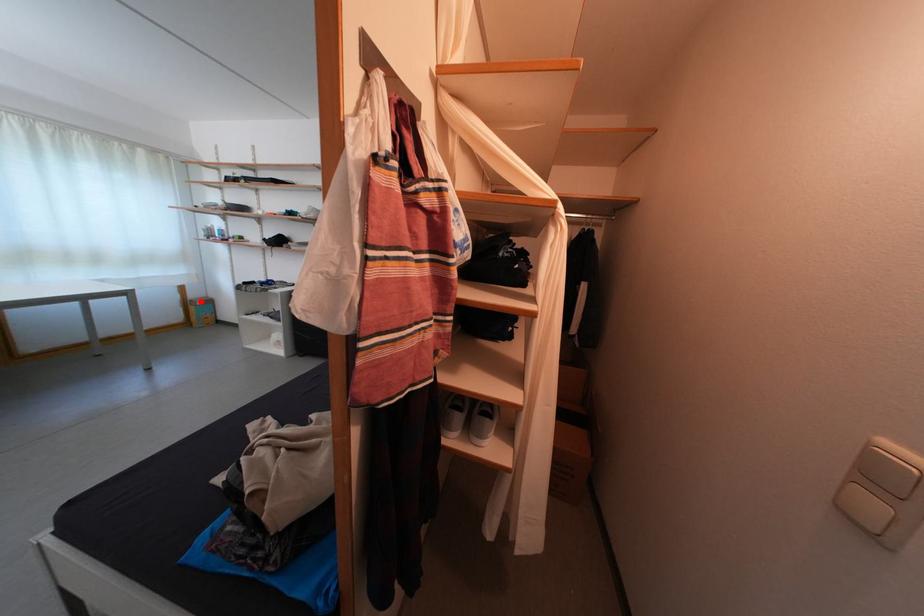
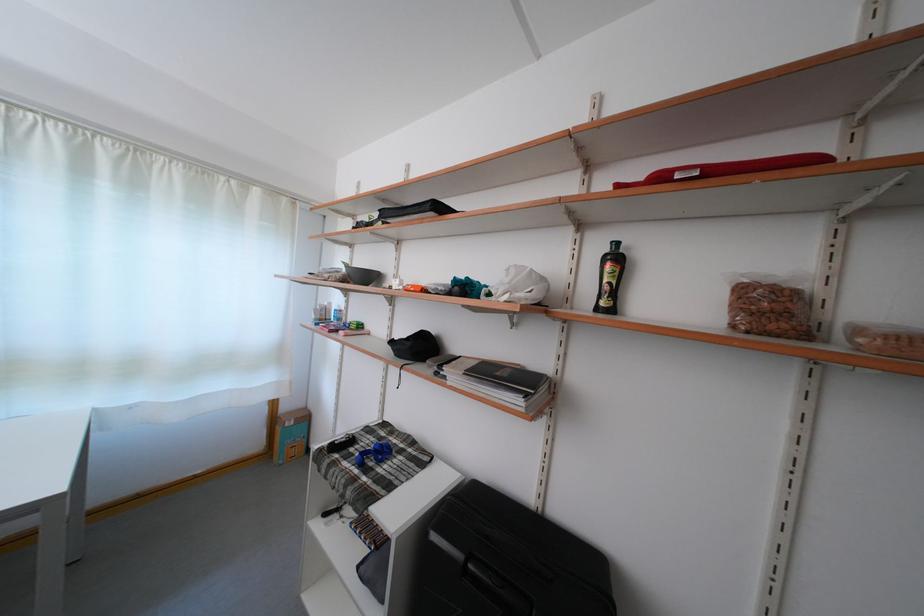
The point at the highlighted location is marked in the first image. Where is the corresponding point in the second image?

(293, 415)